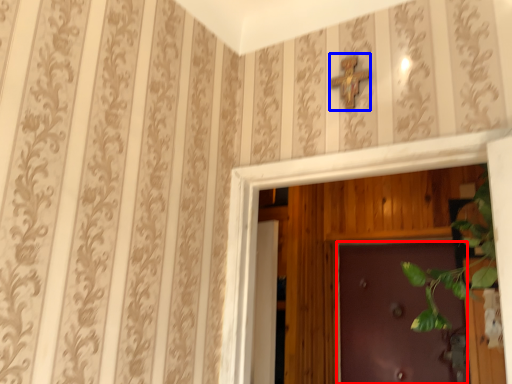
Question: Which point is closer to the camera, door (highlighted by a red box) or cross (highlighted by a blue box)?

Choices:
 (A) door
 (B) cross

Answer: (B)